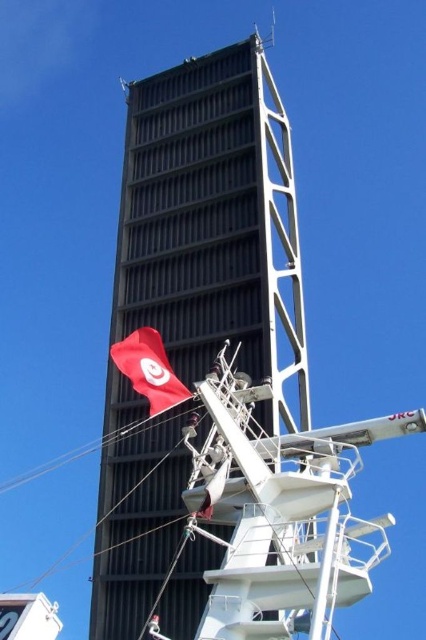
You are a technician standing on the deck of a ship. You need to reach the red fabric flag at left to adjust its position. The black textured panel at center is in your way. Can you safely walk around it to access the flag?

The black textured panel at center is 34.48 feet away from the red fabric flag at left. Since the distance between them is substantial, you can safely walk around the black textured panel at center to reach the red fabric flag at left.

You are on a ship and need to adjust the radar equipment. The black textured panel at center and the red fabric flag at left are both on the mast. Which one is positioned higher up on the mast?

The black textured panel at center is above the red fabric flag at left, so it is positioned higher up on the mast.